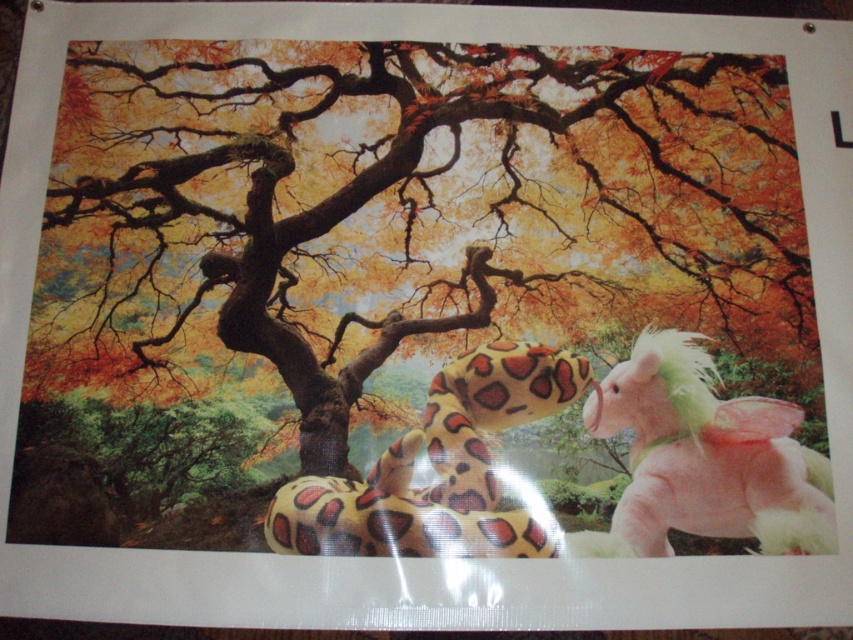
Does pink plush toy at right appear over fluffy yellow snake at center?

Actually, pink plush toy at right is below fluffy yellow snake at center.

Can you confirm if pink plush toy at right is taller than fluffy yellow snake at center?

Correct, pink plush toy at right is much taller as fluffy yellow snake at center.

Is point (641, 340) positioned after point (548, 392)?

That is True.

This screenshot has height=640, width=853. Find the location of `pink plush toy at right`. pink plush toy at right is located at coordinates (704, 458).

Who is lower down, autumn leaves at center or fluffy yellow snake at center?

fluffy yellow snake at center is below.

Is point (288, 179) positioned before point (286, 486)?

No, (288, 179) is behind (286, 486).

Who is more forward, (708, 90) or (393, 506)?

Positioned in front is point (393, 506).

Where is `autumn leaves at center`? This screenshot has width=853, height=640. autumn leaves at center is located at coordinates (402, 214).

Between point (38, 340) and point (677, 404), which one is positioned in front?

Point (677, 404) is more forward.

At what (x,y) coordinates should I click in order to perform the action: click on autumn leaves at center. Please return your answer as a coordinate pair (x, y). The width and height of the screenshot is (853, 640). Looking at the image, I should click on (402, 214).